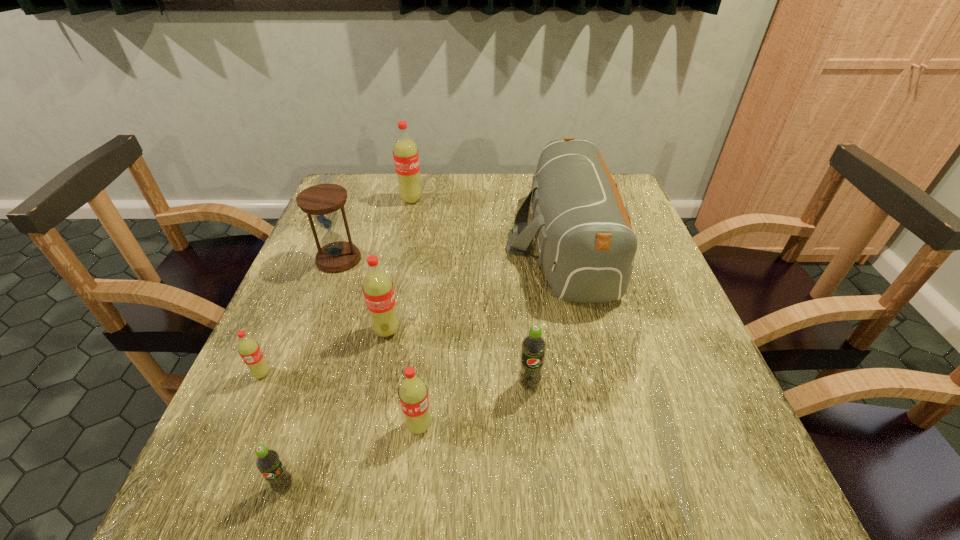
Locate an element on the screen. The image size is (960, 540). the leftmost red soda is located at coordinates (249, 350).

The image size is (960, 540). I want to click on the smallest red soda, so click(249, 350).

The width and height of the screenshot is (960, 540). I want to click on the second soda from left to right, so click(268, 462).

Locate an element on the screen. the nearest soda is located at coordinates (268, 462).

Where is `vacant space situated on the right of the farthest soda`? This screenshot has width=960, height=540. vacant space situated on the right of the farthest soda is located at coordinates (533, 200).

I want to click on free space located 0.170m on the front of the duffel bag, so click(x=596, y=380).

Find the location of a particular element. The height and width of the screenshot is (540, 960). free spot located 0.070m on the front of the third smallest red soda is located at coordinates (379, 370).

At what (x,y) coordinates should I click in order to perform the action: click on free region located on the back of the hourglass. Please return your answer as a coordinate pair (x, y). The height and width of the screenshot is (540, 960). Looking at the image, I should click on (368, 182).

The image size is (960, 540). Identify the location of free space located 0.140m on the front label of the right green soda. (538, 470).

Find the location of a particular element. The image size is (960, 540). free space located on the right of the second soda from right to left is located at coordinates (601, 426).